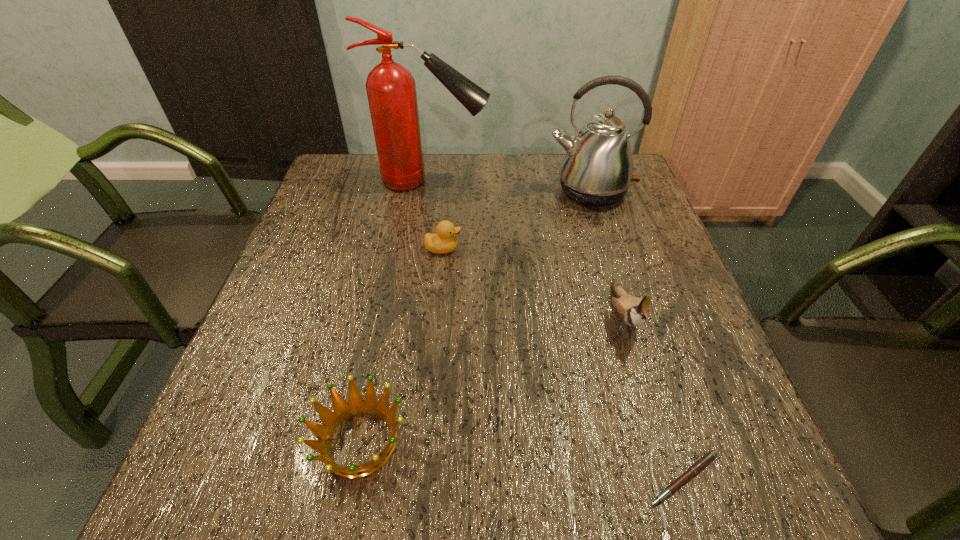
Identify the location of object located in the far left corner section of the desktop. The height and width of the screenshot is (540, 960). (391, 89).

Identify the location of object at the far right corner. Image resolution: width=960 pixels, height=540 pixels. (597, 170).

This screenshot has height=540, width=960. I want to click on object situated at the near right corner, so click(706, 459).

The width and height of the screenshot is (960, 540). I want to click on vacant space at the far edge of the desktop, so click(531, 198).

This screenshot has width=960, height=540. In the image, there is a desktop. In order to click on free space at the near edge in this screenshot , I will do `click(525, 456)`.

Identify the location of free space at the left edge of the desktop. The width and height of the screenshot is (960, 540). (301, 377).

This screenshot has width=960, height=540. Find the location of `free region at the right edge of the desktop`. free region at the right edge of the desktop is located at coordinates (644, 275).

At what (x,y) coordinates should I click in order to perform the action: click on vacant space at the far left corner of the desktop. Please return your answer as a coordinate pair (x, y). The image size is (960, 540). Looking at the image, I should click on (337, 184).

At what (x,y) coordinates should I click in order to perform the action: click on vacant point located between the third farthest object and the fire extinguisher. Please return your answer as a coordinate pair (x, y). Looking at the image, I should click on 437,214.

At what (x,y) coordinates should I click in order to perform the action: click on unoccupied area between the kettle and the tallest object. Please return your answer as a coordinate pair (x, y). Looking at the image, I should click on (511, 186).